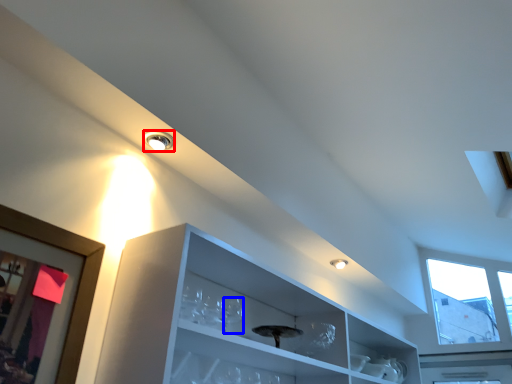
Question: Which point is further to the camera, droplight (highlighted by a red box) or wine glass (highlighted by a blue box)?

Choices:
 (A) droplight
 (B) wine glass

Answer: (A)